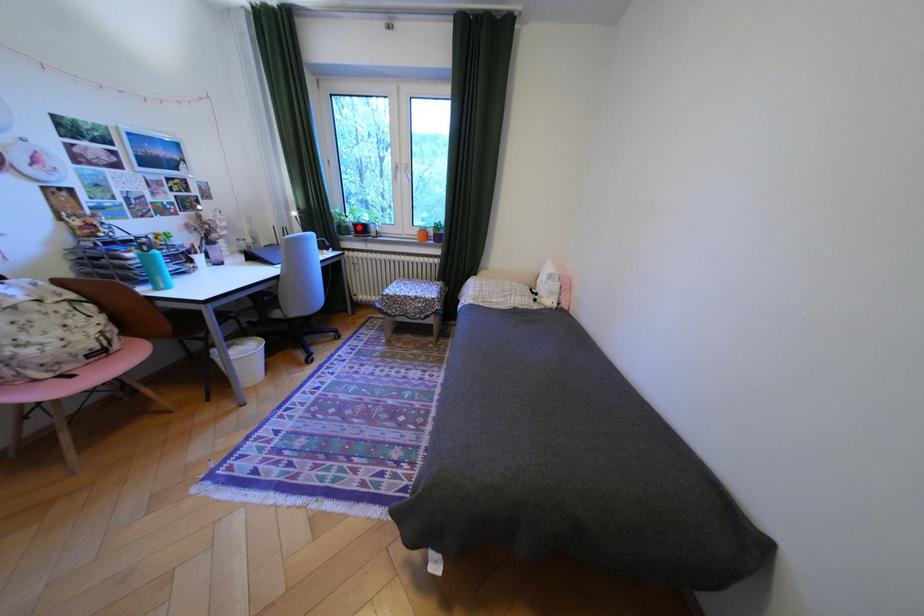
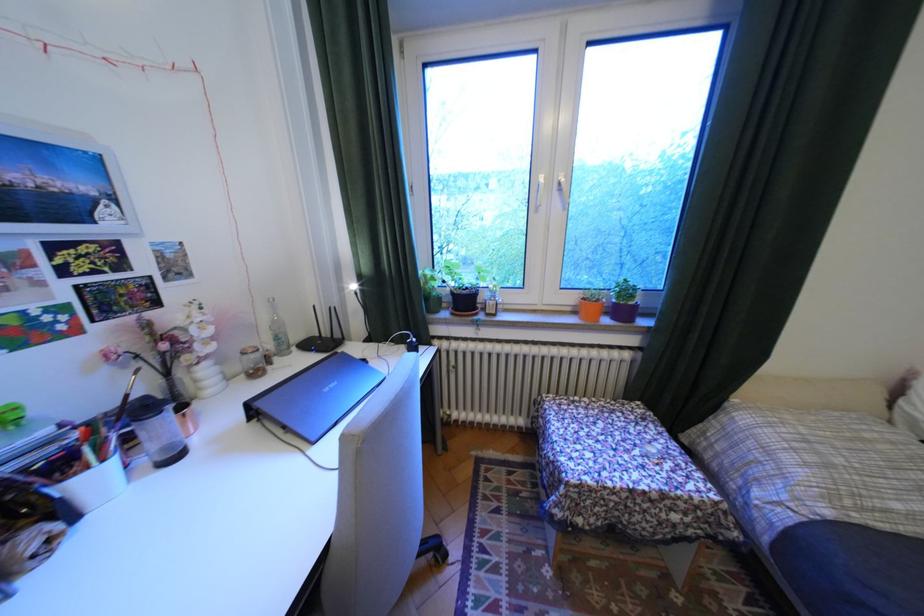
In the second image, find the point that corresponds to the highlighted location in the first image.

(451, 299)